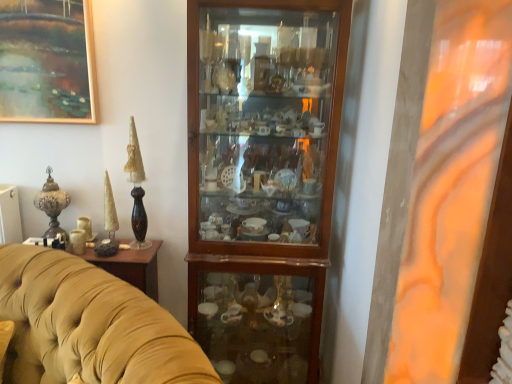
Question: Based on their sizes in the image, would you say velvet yellow couch at center is bigger or smaller than polished bronze vase at left?

Choices:
 (A) big
 (B) small

Answer: (A)

Question: Looking at their shapes, would you say velvet yellow couch at center is wider or thinner than polished bronze vase at left?

Choices:
 (A) wide
 (B) thin

Answer: (A)

Question: Based on their relative distances, which object is farther from the velvet yellow couch at center?

Choices:
 (A) polished bronze vase at left
 (B) wooden cabinet at center

Answer: (B)

Question: Which object is the farthest from the wooden cabinet at center?

Choices:
 (A) polished bronze vase at left
 (B) velvet yellow couch at center

Answer: (A)